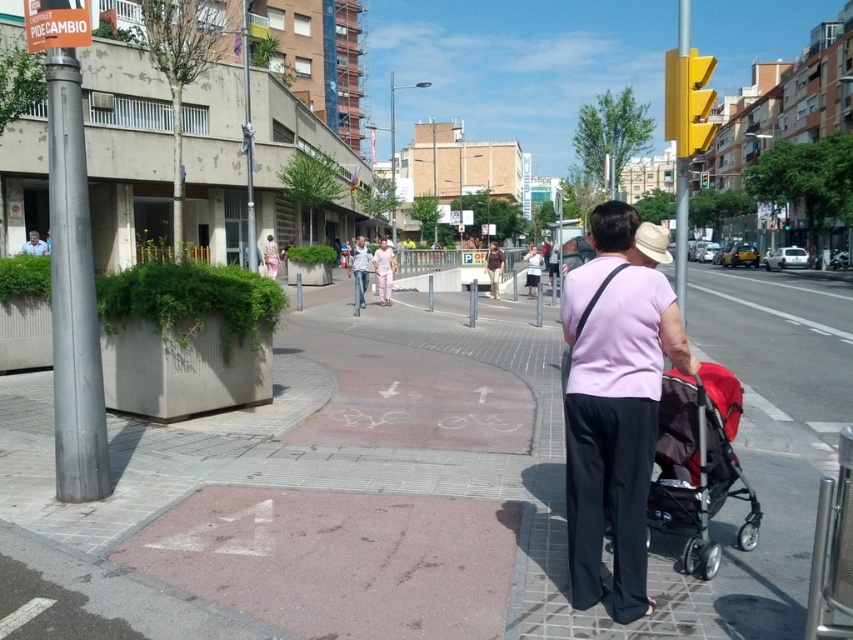
Question: Is pink concrete pavement at center bigger than light blue shirt at upper left?

Choices:
 (A) yes
 (B) no

Answer: (A)

Question: Does light blue jeans at center appear over light blue shirt at upper left?

Choices:
 (A) no
 (B) yes

Answer: (B)

Question: Which point is closer to the camera?

Choices:
 (A) (363, 288)
 (B) (538, 262)
 (C) (265, 244)

Answer: (A)

Question: Is red fabric baby carriage at lower right bigger than light pink fabric shirt at center?

Choices:
 (A) no
 (B) yes

Answer: (A)

Question: Which point appears closest to the camera in this image?

Choices:
 (A) (357, 266)
 (B) (585, 282)

Answer: (B)

Question: Which of these objects is positioned closest to the light pink fabric shirt at center?

Choices:
 (A) light brown leather jacket at center
 (B) white cotton shirt at center

Answer: (A)